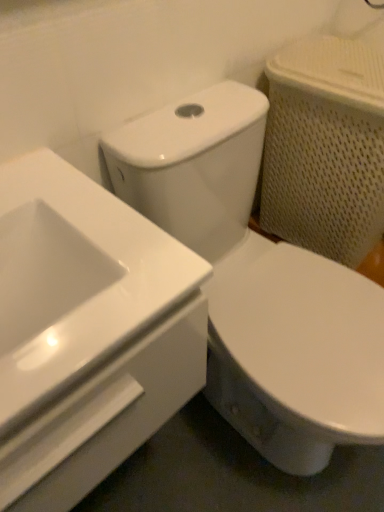
Question: In terms of size, does white glossy toilet at center appear bigger or smaller than white glossy sink at upper left?

Choices:
 (A) small
 (B) big

Answer: (B)

Question: From the image's perspective, relative to white glossy sink at upper left, is white glossy toilet at center above or below?

Choices:
 (A) above
 (B) below

Answer: (B)

Question: In terms of height, does white glossy toilet at center look taller or shorter compared to white glossy sink at upper left?

Choices:
 (A) tall
 (B) short

Answer: (A)

Question: Is white glossy sink at upper left in front of or behind white glossy toilet at center in the image?

Choices:
 (A) front
 (B) behind

Answer: (A)

Question: From the image's perspective, is white glossy sink at upper left located above or below white glossy toilet at center?

Choices:
 (A) below
 (B) above

Answer: (B)

Question: Considering the positions of white glossy sink at upper left and white glossy toilet at center in the image, is white glossy sink at upper left bigger or smaller than white glossy toilet at center?

Choices:
 (A) big
 (B) small

Answer: (B)

Question: Considering the positions of white glossy sink at upper left and white glossy toilet at center in the image, is white glossy sink at upper left wider or thinner than white glossy toilet at center?

Choices:
 (A) thin
 (B) wide

Answer: (A)